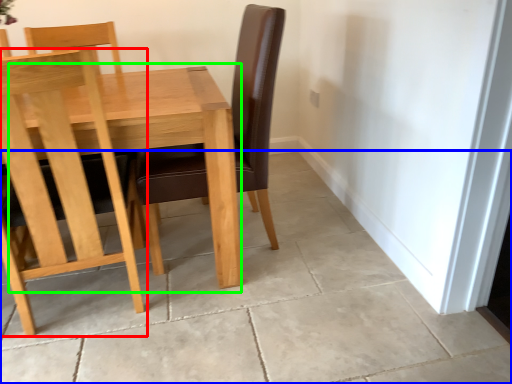
Question: Which is farther away from chair (highlighted by a red box)? concrete (highlighted by a blue box) or table (highlighted by a green box)?

Choices:
 (A) concrete
 (B) table

Answer: (A)